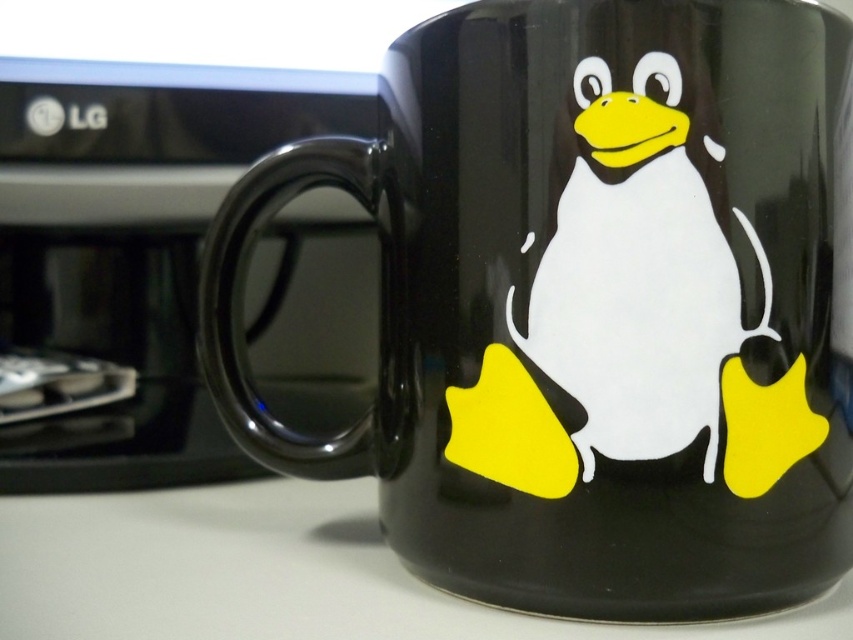
Question: Is black glossy monitor at upper left bigger than white glossy table at lower center?

Choices:
 (A) no
 (B) yes

Answer: (B)

Question: Among these points, which one is nearest to the camera?

Choices:
 (A) (97, 595)
 (B) (350, 384)
 (C) (642, 332)

Answer: (C)

Question: Is black glossy monitor at upper left smaller than white glossy table at lower center?

Choices:
 (A) yes
 (B) no

Answer: (B)

Question: Which point is closer to the camera taking this photo?

Choices:
 (A) (332, 221)
 (B) (252, 496)

Answer: (B)

Question: Which of the following is the farthest from the observer?

Choices:
 (A) white glossy table at lower center
 (B) white glossy penguin at center

Answer: (A)

Question: Is white glossy table at lower center further to the viewer compared to white glossy penguin at center?

Choices:
 (A) yes
 (B) no

Answer: (A)